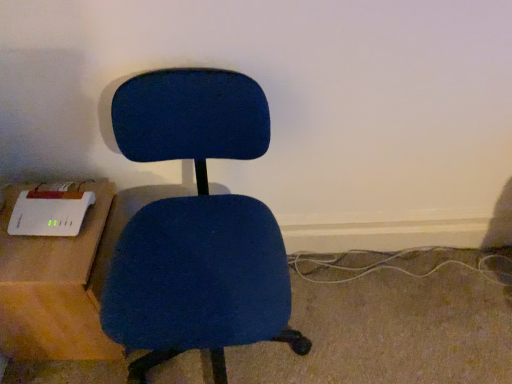
Question: From a real-world perspective, is matte blue office chair at center on white plastic router at left?

Choices:
 (A) yes
 (B) no

Answer: (A)

Question: Does matte blue office chair at center turn towards white plastic router at left?

Choices:
 (A) no
 (B) yes

Answer: (A)

Question: Is the position of matte blue office chair at center less distant than that of white plastic router at left?

Choices:
 (A) no
 (B) yes

Answer: (B)

Question: Is matte blue office chair at center surrounding white plastic router at left?

Choices:
 (A) no
 (B) yes

Answer: (A)

Question: Does matte blue office chair at center lie behind white plastic router at left?

Choices:
 (A) yes
 (B) no

Answer: (B)

Question: Is matte blue office chair at center completely or partially outside of white plastic router at left?

Choices:
 (A) yes
 (B) no

Answer: (A)

Question: Does white plastic router at left appear on the right side of matte blue office chair at center?

Choices:
 (A) yes
 (B) no

Answer: (B)

Question: Does white plastic router at left come in front of matte blue office chair at center?

Choices:
 (A) no
 (B) yes

Answer: (A)

Question: From the image's perspective, is white plastic router at left on top of matte blue office chair at center?

Choices:
 (A) no
 (B) yes

Answer: (A)

Question: Is white plastic router at left oriented towards matte blue office chair at center?

Choices:
 (A) yes
 (B) no

Answer: (A)

Question: Would you consider white plastic router at left to be distant from matte blue office chair at center?

Choices:
 (A) yes
 (B) no

Answer: (B)

Question: Considering the relative positions of white plastic router at left and matte blue office chair at center in the image provided, is white plastic router at left to the left of matte blue office chair at center from the viewer's perspective?

Choices:
 (A) yes
 (B) no

Answer: (A)

Question: From a real-world perspective, is white plastic router at left physically located above or below matte blue office chair at center?

Choices:
 (A) below
 (B) above

Answer: (A)